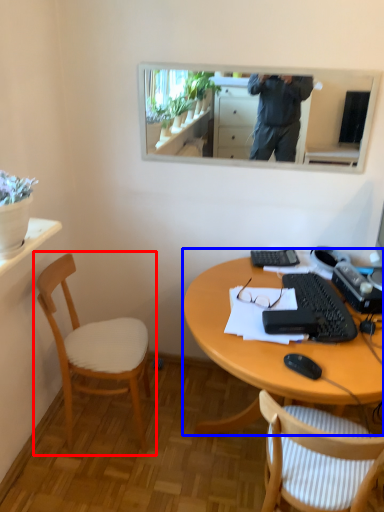
Question: Which point is further to the camera, chair (highlighted by a red box) or desk (highlighted by a blue box)?

Choices:
 (A) chair
 (B) desk

Answer: (A)